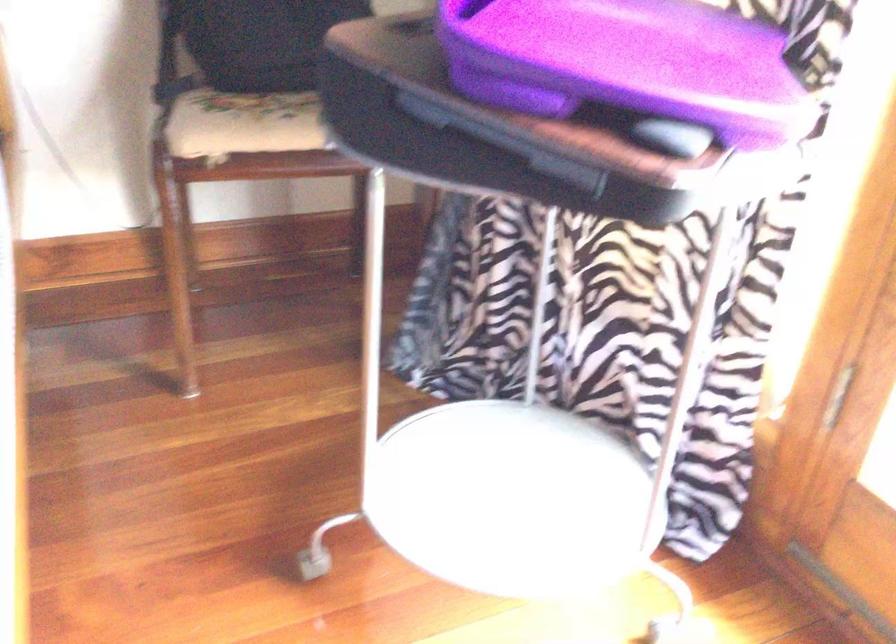
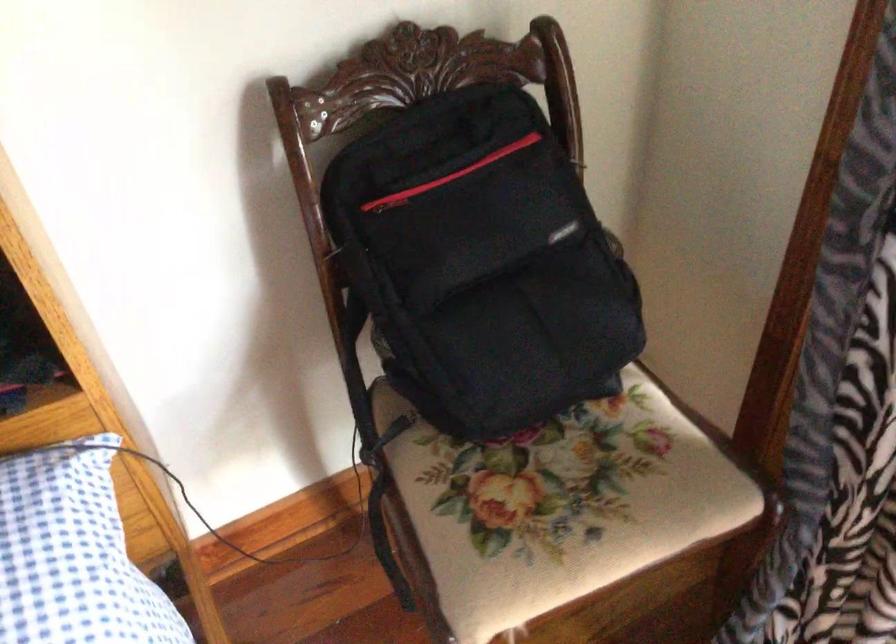
In a continuous first-person perspective shot, in which direction is the camera moving?

The cameraman moved toward left, forward.